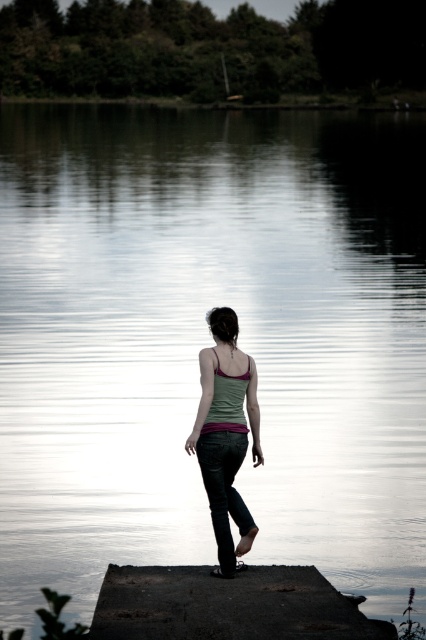
You are a photographer trying to capture the entire dark concrete dock at center and matte green tank top at center in a single frame. Given their sizes, will you need to adjust your camera angle to include both?

The dark concrete dock at center is larger in size than the matte green tank top at center, so you will need to adjust your camera angle to ensure both fit within the frame.

You are a photographer positioned at the edge of the lake, wanting to capture a shot of the dark concrete dock at center and the matte green tank top at center. Since you want both subjects in the frame, which direction should you move to ensure both are visible?

The dark concrete dock at center is to the left of matte green tank top at center, so you should move to the right to ensure both are visible.

You are standing at the edge of the lake and want to reach the point marked as point (227,605). Which direction should you walk from your current position at the edge of the lake to reach it?

The point (227,605) is located on the dark concrete dock at center, so you should walk towards the dark concrete dock at center to reach it.